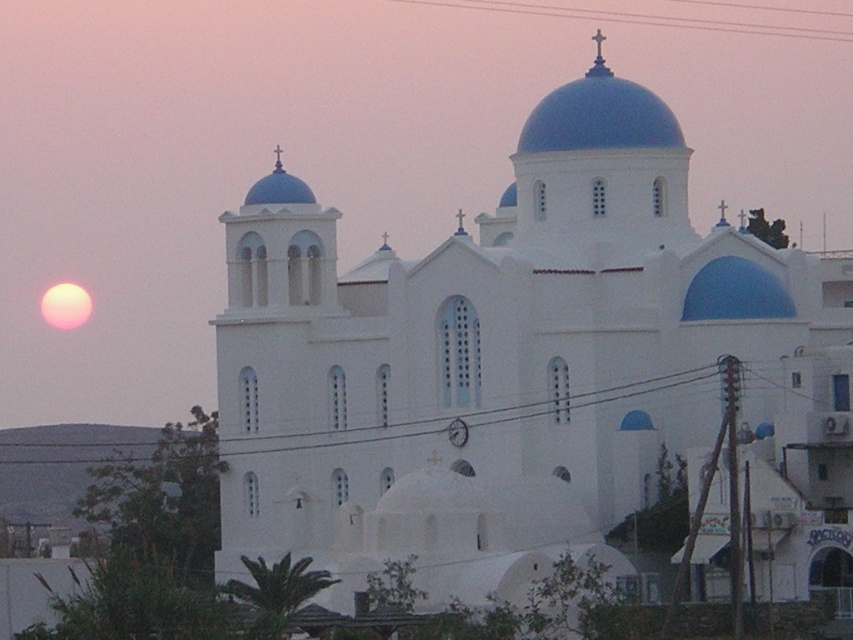
Question: Which point is closer to the camera?

Choices:
 (A) white smooth church at center
 (B) black wire at lower center

Answer: (A)

Question: Considering the relative positions of white smooth church at center and metallic wire at upper center in the image provided, where is white smooth church at center located with respect to metallic wire at upper center?

Choices:
 (A) right
 (B) left

Answer: (B)

Question: Is white smooth church at center above metallic wire at upper center?

Choices:
 (A) no
 (B) yes

Answer: (A)

Question: Is the position of metallic wire at upper center more distant than that of black wire at lower center?

Choices:
 (A) yes
 (B) no

Answer: (A)

Question: Which point appears closest to the camera in this image?

Choices:
 (A) (200, 419)
 (B) (590, 10)

Answer: (A)

Question: Considering the real-world distances, which object is closest to the metallic wire at upper center?

Choices:
 (A) black wire at lower center
 (B) white smooth church at center

Answer: (A)